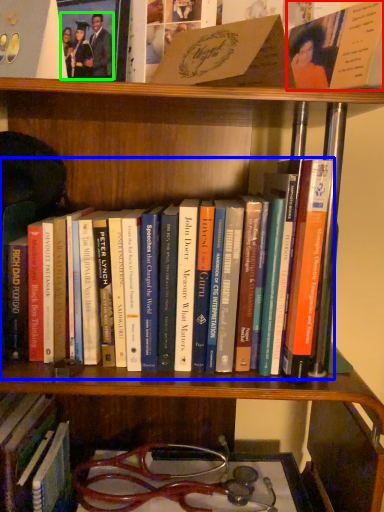
Question: Based on their relative distances, which object is farther from book (highlighted by a red box)? Choose from book (highlighted by a blue box) and couple (highlighted by a green box).

Choices:
 (A) book
 (B) couple

Answer: (B)